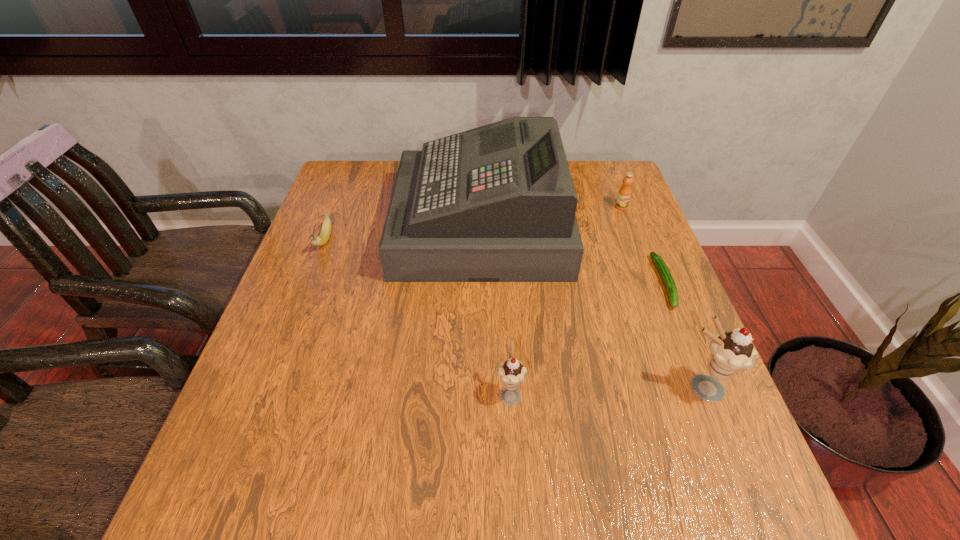
The width and height of the screenshot is (960, 540). I want to click on free space at the near right corner of the desktop, so click(652, 419).

I want to click on empty space that is in between the shorter icecream and the shortest object, so click(588, 338).

Find the location of a particular element. The height and width of the screenshot is (540, 960). vacant space in between the banana and the fourth shortest object is located at coordinates (418, 317).

Locate an element on the screen. The image size is (960, 540). vacant space that is in between the second tallest object and the left icecream is located at coordinates (606, 390).

Locate an element on the screen. The image size is (960, 540). free space between the zucchini and the fourth shortest object is located at coordinates (588, 338).

The image size is (960, 540). I want to click on empty space that is in between the cash register and the second tallest object, so click(591, 307).

What are the coordinates of `empty space between the fourth shortest object and the leftmost object` in the screenshot? It's located at (418, 317).

Locate an element on the screen. vacant area that lies between the second tallest object and the fourth tallest object is located at coordinates (661, 298).

At what (x,y) coordinates should I click in order to perform the action: click on free space between the zucchini and the orange juice. Please return your answer as a coordinate pair (x, y). This screenshot has height=540, width=960. Looking at the image, I should click on (643, 245).

The image size is (960, 540). What are the coordinates of `free point between the shorter icecream and the tallest object` in the screenshot? It's located at (495, 309).